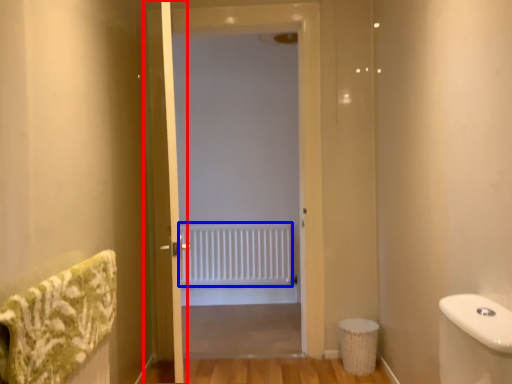
Question: Among these objects, which one is farthest to the camera, screen door (highlighted by a red box) or radiator (highlighted by a blue box)?

Choices:
 (A) screen door
 (B) radiator

Answer: (B)